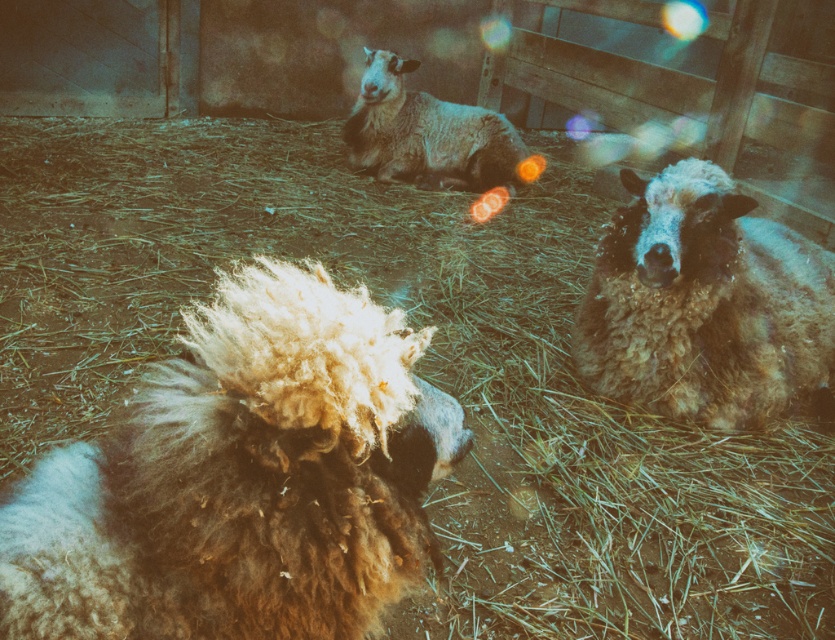
You are a farmer checking the barn. You notice the fluffy brown wool at center and the fuzzy brown sheep at center. Which one is taller?

The fluffy brown wool at center is not as tall as the fuzzy brown sheep at center, so the fuzzy brown sheep at center is taller.